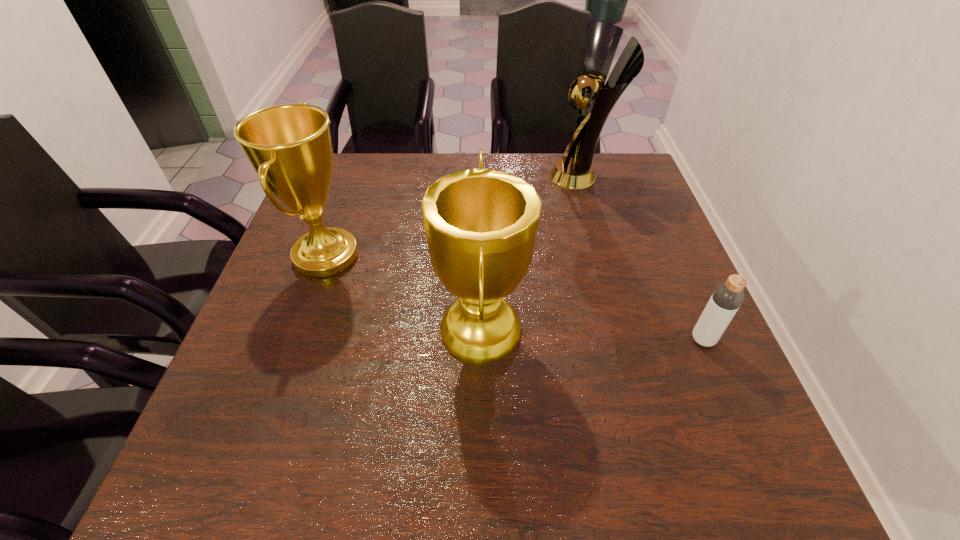
The height and width of the screenshot is (540, 960). I want to click on free space between the leftmost object and the second award from right to left, so click(403, 294).

Identify the location of vacant point located between the leftmost award and the second object from left to right. (403, 294).

Locate which object is the second closest to the third object from right to left. Please provide its 2D coordinates. Your answer should be formatted as a tuple, i.e. [(x, y)], where the tuple contains the x and y coordinates of a point satisfying the conditions above.

[(595, 99)]

Choose which object is the nearest neighbor to the third object from right to left. Please provide its 2D coordinates. Your answer should be formatted as a tuple, i.e. [(x, y)], where the tuple contains the x and y coordinates of a point satisfying the conditions above.

[(289, 146)]

Locate which award ranks in proximity to the leftmost object. Please provide its 2D coordinates. Your answer should be formatted as a tuple, i.e. [(x, y)], where the tuple contains the x and y coordinates of a point satisfying the conditions above.

[(480, 224)]

Locate which award ranks second in proximity to the rightmost award. Please provide its 2D coordinates. Your answer should be formatted as a tuple, i.e. [(x, y)], where the tuple contains the x and y coordinates of a point satisfying the conditions above.

[(289, 146)]

Find the location of `free space that satisfies the following two spatial constraints: 1. on the shiny surface of the rightmost object; 2. on the left side of the second object from left to right`. free space that satisfies the following two spatial constraints: 1. on the shiny surface of the rightmost object; 2. on the left side of the second object from left to right is located at coordinates (481, 340).

This screenshot has width=960, height=540. I want to click on vacant space that satisfies the following two spatial constraints: 1. on the shiny surface of the bottle; 2. on the right side of the second object from left to right, so click(x=481, y=340).

Image resolution: width=960 pixels, height=540 pixels. What are the coordinates of `free point that satisfies the following two spatial constraints: 1. at the front of the farthest object, where the globe is visible; 2. on the back side of the bottle` in the screenshot? It's located at (629, 340).

You are a GUI agent. You are given a task and a screenshot of the screen. Output one action in this format:
    pyautogui.click(x=<x>, y=<y>)
    Task: Click on the vacant area in the image that satisfies the following two spatial constraints: 1. at the front of the shortest object, where the globe is visible; 2. on the left side of the rightmost award
    
    Given the screenshot: What is the action you would take?
    pyautogui.click(x=629, y=340)